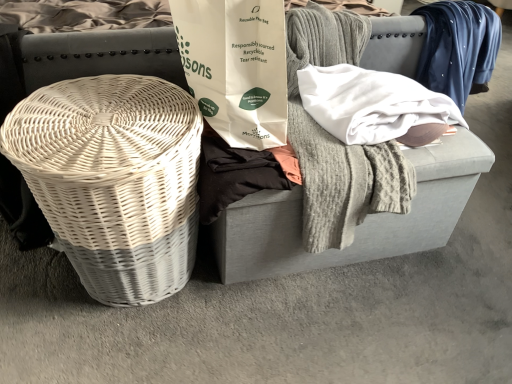
Question: From the image's perspective, would you say white paper bag at center is positioned over white wicker basket at left?

Choices:
 (A) yes
 (B) no

Answer: (B)

Question: Is white paper bag at center wider than white wicker basket at left?

Choices:
 (A) no
 (B) yes

Answer: (A)

Question: Is white paper bag at center positioned far away from white wicker basket at left?

Choices:
 (A) no
 (B) yes

Answer: (A)

Question: Does white paper bag at center appear on the right side of white wicker basket at left?

Choices:
 (A) yes
 (B) no

Answer: (A)

Question: Are white paper bag at center and white wicker basket at left making contact?

Choices:
 (A) yes
 (B) no

Answer: (B)

Question: Considering the relative sizes of white paper bag at center and white wicker basket at left in the image provided, is white paper bag at center taller than white wicker basket at left?

Choices:
 (A) no
 (B) yes

Answer: (A)

Question: Can you confirm if black cotton shirt at center is taller than gray fabric footrest at center?

Choices:
 (A) yes
 (B) no

Answer: (B)

Question: Considering the relative positions of black cotton shirt at center and gray fabric footrest at center in the image provided, is black cotton shirt at center to the left of gray fabric footrest at center from the viewer's perspective?

Choices:
 (A) no
 (B) yes

Answer: (B)

Question: From a real-world perspective, is black cotton shirt at center physically above gray fabric footrest at center?

Choices:
 (A) no
 (B) yes

Answer: (B)

Question: Does black cotton shirt at center have a lesser width compared to gray fabric footrest at center?

Choices:
 (A) no
 (B) yes

Answer: (B)

Question: Considering the relative sizes of black cotton shirt at center and gray fabric footrest at center in the image provided, is black cotton shirt at center smaller than gray fabric footrest at center?

Choices:
 (A) no
 (B) yes

Answer: (B)

Question: From a real-world perspective, is black cotton shirt at center physically below gray fabric footrest at center?

Choices:
 (A) no
 (B) yes

Answer: (A)

Question: From the image's perspective, is white wicker basket at left under gray fabric footrest at center?

Choices:
 (A) yes
 (B) no

Answer: (A)